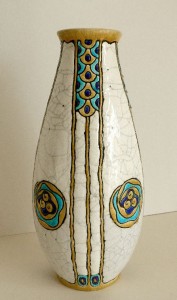
Find the location of a particular element. Image resolution: width=177 pixels, height=300 pixels. left edge of vase is located at coordinates (34, 166).